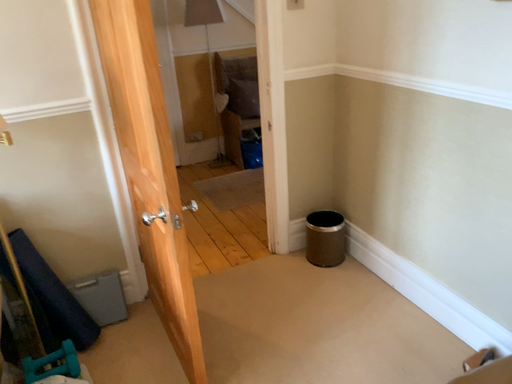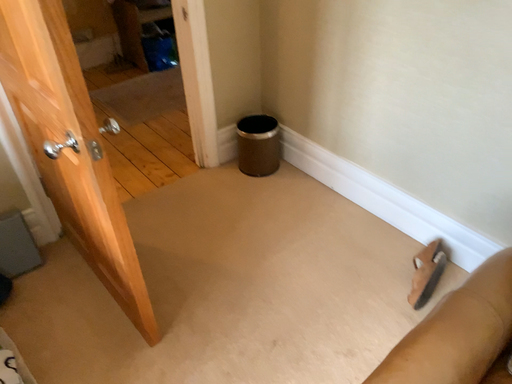
Question: How did the camera likely rotate when shooting the video?

Choices:
 (A) rotated left
 (B) rotated right

Answer: (B)